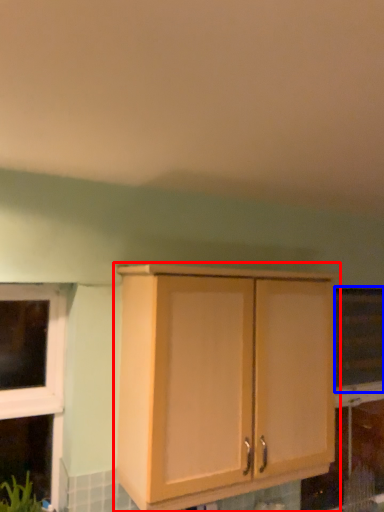
Question: Which object is further to the camera taking this photo, cabinetry (highlighted by a red box) or window screen (highlighted by a blue box)?

Choices:
 (A) cabinetry
 (B) window screen

Answer: (B)